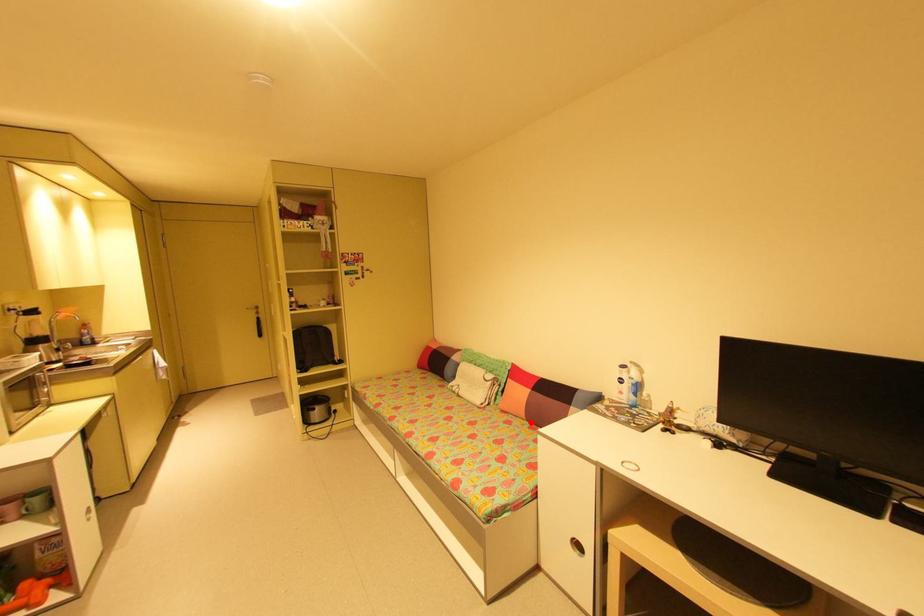
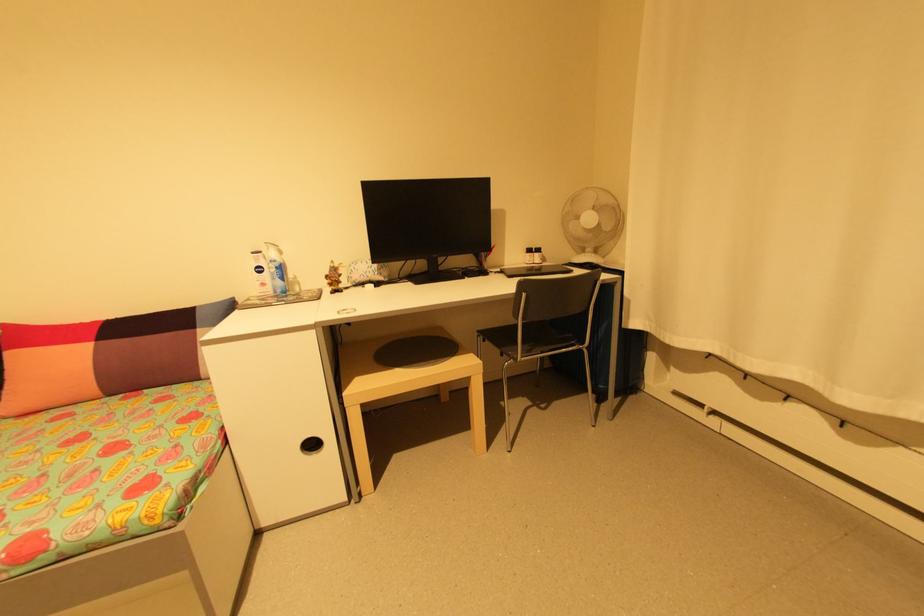
In the second image, find the point that corresponds to the highlighted location in the first image.

(111, 399)